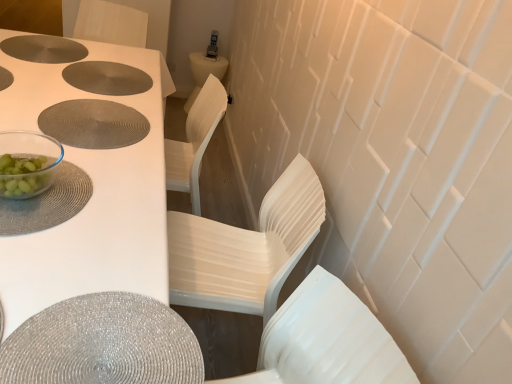
Question: Is matte silver placemat at center, the third hole positioned from the top, far away from white glossy table at upper left?

Choices:
 (A) yes
 (B) no

Answer: (B)

Question: Can you confirm if matte silver placemat at center, which ranks as the first hole in bottom-to-top order, is thinner than white glossy table at upper left?

Choices:
 (A) no
 (B) yes

Answer: (B)

Question: Is matte silver placemat at center, which ranks as the first hole in bottom-to-top order, completely or partially outside of white glossy table at upper left?

Choices:
 (A) yes
 (B) no

Answer: (B)

Question: Considering the relative sizes of matte silver placemat at center, the third hole positioned from the top, and white glossy table at upper left in the image provided, is matte silver placemat at center, the third hole positioned from the top, wider than white glossy table at upper left?

Choices:
 (A) no
 (B) yes

Answer: (A)

Question: Is matte silver placemat at center, which ranks as the first hole in bottom-to-top order, oriented away from white glossy table at upper left?

Choices:
 (A) yes
 (B) no

Answer: (A)

Question: Can you confirm if matte silver placemat at center, the third hole positioned from the top, is positioned to the left of white glossy table at upper left?

Choices:
 (A) yes
 (B) no

Answer: (B)

Question: From a real-world perspective, does matte silver placemat at center, the third hole positioned from the top, stand above white plastic chair at center, the first chair positioned from the back?

Choices:
 (A) no
 (B) yes

Answer: (B)

Question: Is matte silver placemat at center, which ranks as the first hole in bottom-to-top order, positioned behind white plastic chair at center, the first chair positioned from the back?

Choices:
 (A) yes
 (B) no

Answer: (A)

Question: Is matte silver placemat at center, the third hole positioned from the top, not near white plastic chair at center, the first chair positioned from the back?

Choices:
 (A) yes
 (B) no

Answer: (B)

Question: Does matte silver placemat at center, the third hole positioned from the top, lie in front of white plastic chair at center, the first chair positioned from the back?

Choices:
 (A) yes
 (B) no

Answer: (B)

Question: Can you confirm if matte silver placemat at center, which ranks as the first hole in bottom-to-top order, is taller than white plastic chair at center, the 2th chair viewed from the front?

Choices:
 (A) yes
 (B) no

Answer: (B)

Question: Is matte silver placemat at center, the third hole positioned from the top, to the left of white plastic chair at center, the first chair positioned from the back, from the viewer's perspective?

Choices:
 (A) yes
 (B) no

Answer: (A)

Question: From a real-world perspective, is white plastic chair at center, the 2th chair viewed from the front, on white plastic chair at center, the first chair viewed from the front?

Choices:
 (A) yes
 (B) no

Answer: (B)